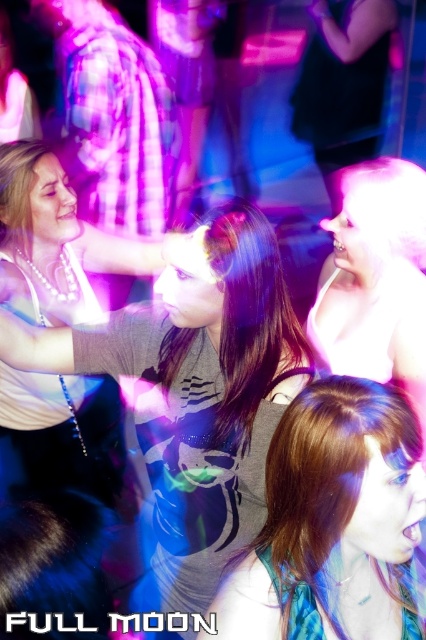
From the picture: You are a photographer trying to capture a clear shot of the two people at the center of the nightclub scene. The subjects are the person wearing a matte gray shirt at center and the individual with shiny brown hair at center. Given their positions and the lighting, which of these two subjects is positioned higher up in the frame?

The matte gray shirt at center is positioned higher up in the frame compared to the shiny brown hair at center, as it has a greater height according to the description.

You are a photographer trying to capture a candid shot of the matte gray shirt at center and the shiny white hair at upper right. If your camera has a depth of field that can focus on objects within a 15 inch range, will both subjects be in focus?

The distance between the matte gray shirt at center and the shiny white hair at upper right is 16.62 inches. Since this exceeds the 15 inch range of the camera, both subjects cannot be in focus simultaneously.

You are at a party and want to take a photo of the matte gray shirt at center and the shiny white hair at upper right. To ensure both are in frame, which direction should you move your camera? Explain your reasoning based on their positions.

The matte gray shirt at center is to the left of the shiny white hair at upper right. To ensure both are in frame, move the camera to the right so that the shiny white hair at upper right is included while keeping the matte gray shirt at center visible.